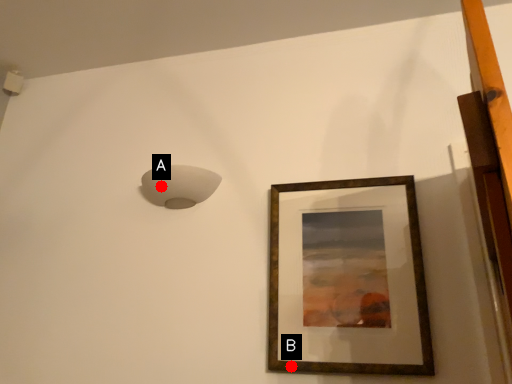
Question: Two points are circled on the image, labeled by A and B beside each circle. Which point appears closest to the camera in this image?

Choices:
 (A) A is closer
 (B) B is closer

Answer: (B)